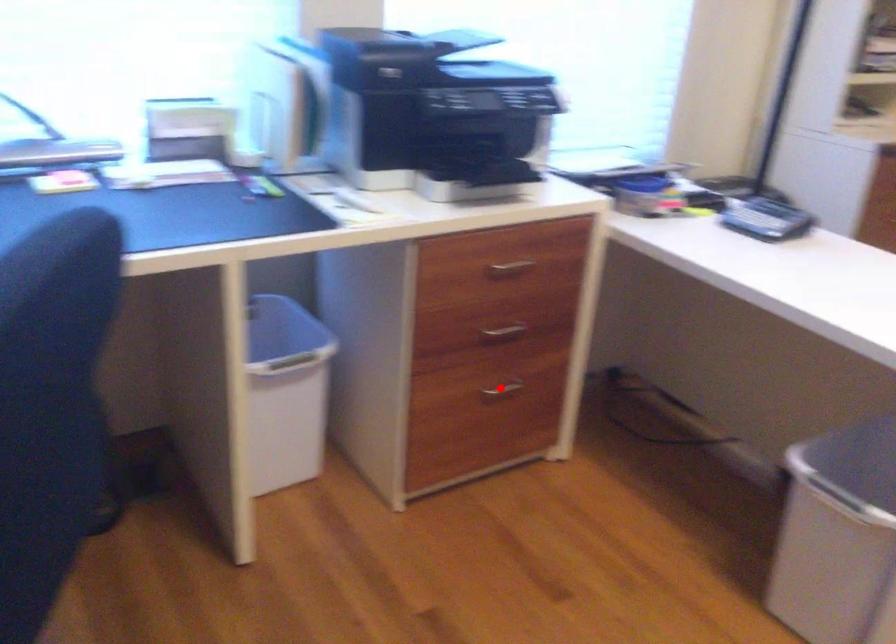
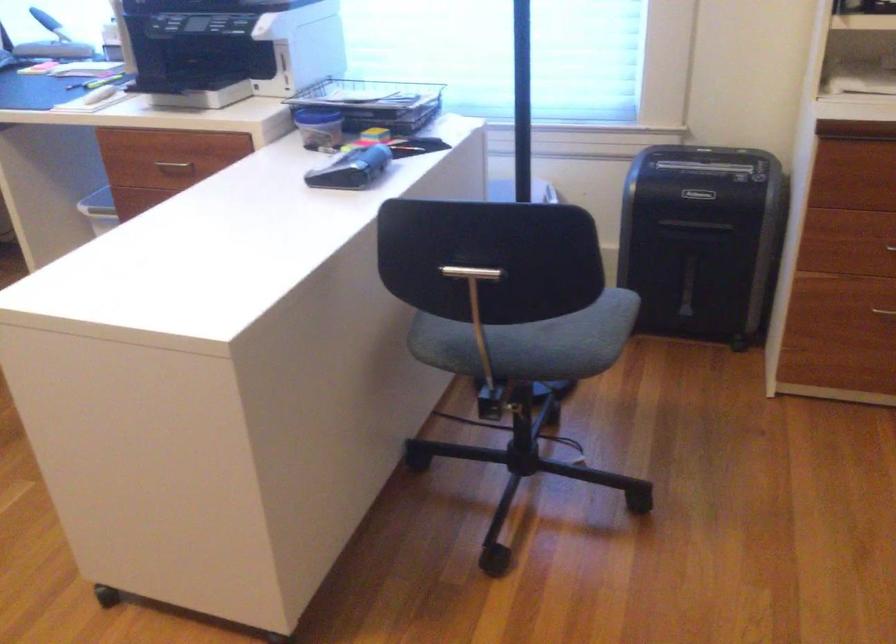
Question: I am providing you with two images of the same scene from different viewpoints. A red point is marked on the first image. At the location where the point appears in image 1, is it still visible in image 2?

Choices:
 (A) Yes
 (B) No

Answer: (B)